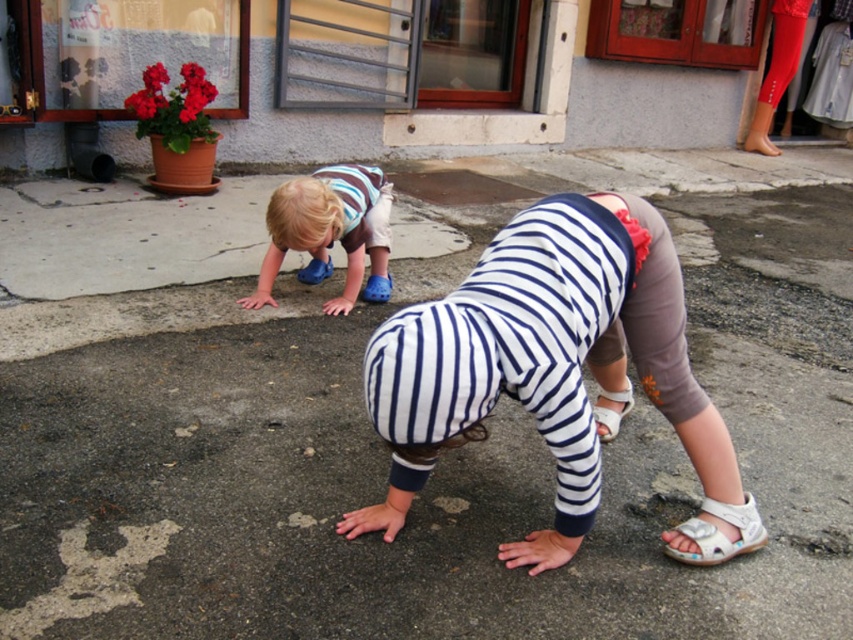
Is point (537, 474) positioned behind point (674, 531)?

Yes, it is behind point (674, 531).

Which is behind, point (3, 499) or point (697, 522)?

The point (3, 499) is behind.

Locate an element on the screen. gray asphalt at center is located at coordinates (436, 470).

Which is behind, point (265, 285) or point (763, 541)?

Point (265, 285)

Which of these two, matte blue shoes at lower left or white leather sandal at lower right, stands shorter?

Standing shorter between the two is white leather sandal at lower right.

Measure the distance between point (271, 212) and camera.

Point (271, 212) is 3.07 meters from camera.

Image resolution: width=853 pixels, height=640 pixels. I want to click on matte blue shoes at lower left, so click(x=329, y=230).

Between point (68, 465) and point (602, 406), which one is positioned behind?

The point (602, 406) is behind.

Is gray asphalt at center smaller than white leather sandal at lower center?

Actually, gray asphalt at center might be larger than white leather sandal at lower center.

Image resolution: width=853 pixels, height=640 pixels. What do you see at coordinates (436, 470) in the screenshot?
I see `gray asphalt at center` at bounding box center [436, 470].

You are a GUI agent. You are given a task and a screenshot of the screen. Output one action in this format:
    pyautogui.click(x=<x>, y=<y>)
    Task: Click on the gray asphalt at center
    This screenshot has width=853, height=640.
    Given the screenshot: What is the action you would take?
    pyautogui.click(x=436, y=470)